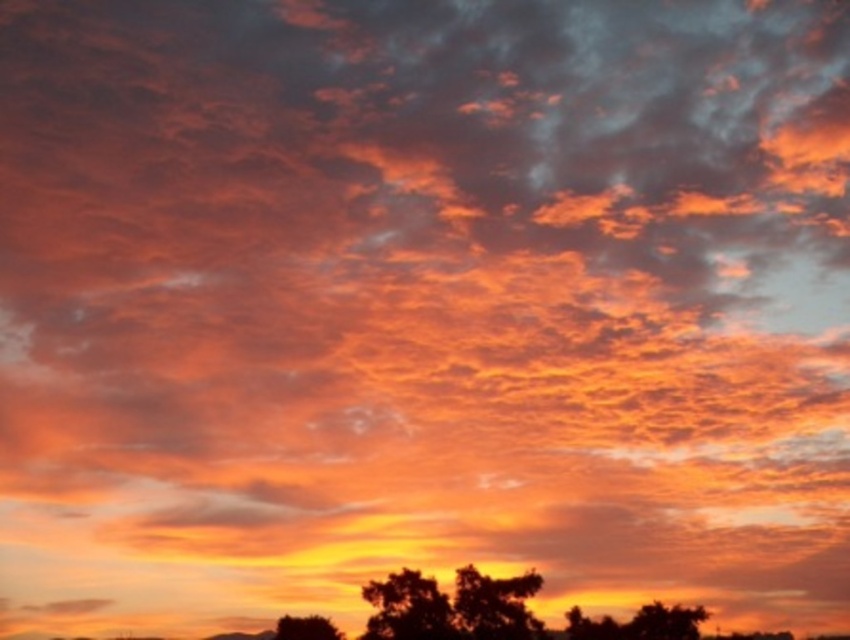
Question: Is green leafy tree at lower right below silhouette leafy tree at lower center?

Choices:
 (A) no
 (B) yes

Answer: (A)

Question: Does silhouette tree at lower center appear on the right side of black matte tree at lower center?

Choices:
 (A) yes
 (B) no

Answer: (A)

Question: Which object is positioned farthest from the silhouette leafy tree at lower center?

Choices:
 (A) green leafy tree at lower right
 (B) silhouette tree at lower center
 (C) silhouetted leafy tree at lower center
 (D) black matte tree at lower center

Answer: (A)

Question: Is silhouette tree at lower center wider than black matte tree at lower center?

Choices:
 (A) no
 (B) yes

Answer: (B)

Question: Which object is closer to the camera taking this photo?

Choices:
 (A) black matte tree at lower center
 (B) green leafy tree at lower right
 (C) silhouetted leafy tree at lower center
 (D) silhouette leafy tree at lower center

Answer: (B)

Question: Which is farther from the black matte tree at lower center?

Choices:
 (A) silhouette leafy tree at lower center
 (B) silhouette tree at lower center

Answer: (A)